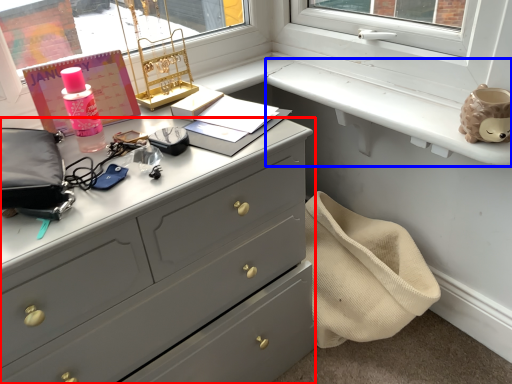
Question: Which object is further to the camera taking this photo, chest of drawers (highlighted by a red box) or window sill (highlighted by a blue box)?

Choices:
 (A) chest of drawers
 (B) window sill

Answer: (B)